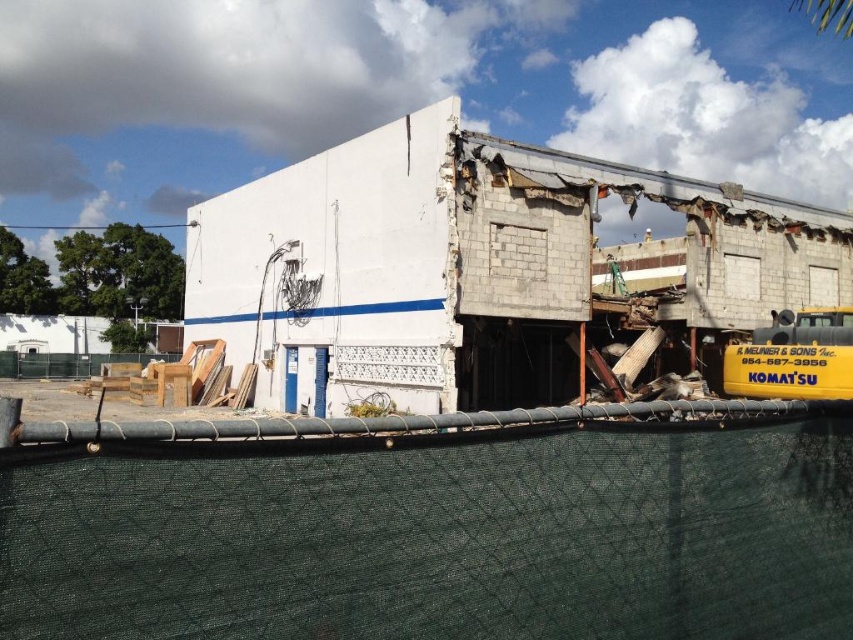
Who is positioned more to the right, white concrete building at center or yellow matte school bus at right?

white concrete building at center is more to the right.

You are a GUI agent. You are given a task and a screenshot of the screen. Output one action in this format:
    pyautogui.click(x=<x>, y=<y>)
    Task: Click on the white concrete building at center
    Image resolution: width=853 pixels, height=640 pixels.
    Given the screenshot: What is the action you would take?
    pyautogui.click(x=489, y=273)

The height and width of the screenshot is (640, 853). What do you see at coordinates (489, 273) in the screenshot?
I see `white concrete building at center` at bounding box center [489, 273].

Where is `white concrete building at center`? white concrete building at center is located at coordinates (489, 273).